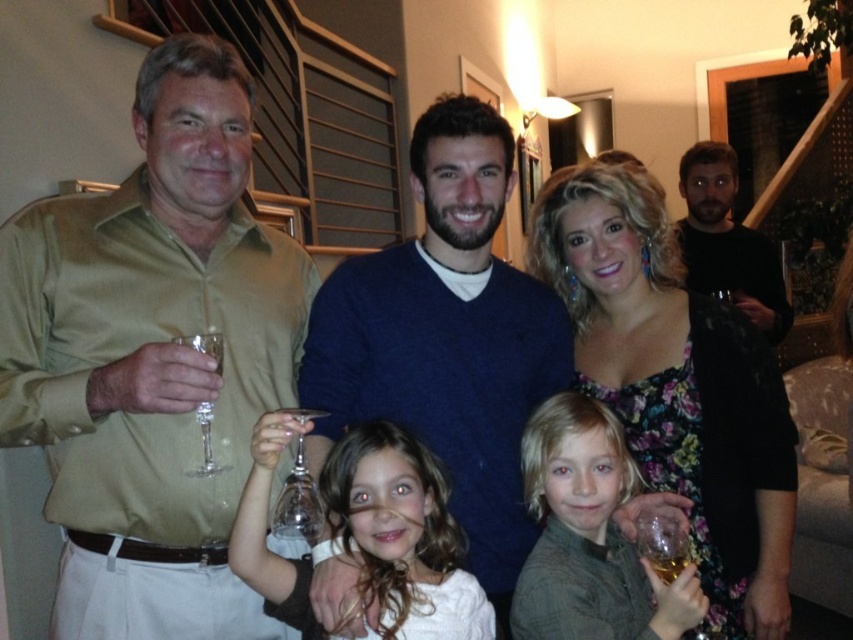
Is floral dress at center behind transparent glass wine glass at lower center?

Yes, floral dress at center is further from the viewer.

Is floral dress at center to the left of transparent glass wine glass at lower center from the viewer's perspective?

Incorrect, floral dress at center is not on the left side of transparent glass wine glass at lower center.

Is point (753, 394) positioned in front of point (299, 497)?

No.

This screenshot has width=853, height=640. Find the location of `floral dress at center`. floral dress at center is located at coordinates (676, 384).

Consider the image. Who is higher up, matte khaki shirt at left or floral dress at center?

matte khaki shirt at left is higher up.

Is matte khaki shirt at left below floral dress at center?

No, matte khaki shirt at left is not below floral dress at center.

Identify the location of matte khaki shirt at left. The image size is (853, 640). (152, 356).

Does matte khaki shirt at left appear over dark blue sweater at center?

Indeed, matte khaki shirt at left is positioned over dark blue sweater at center.

Does matte khaki shirt at left appear under dark blue sweater at center?

Actually, matte khaki shirt at left is above dark blue sweater at center.

The image size is (853, 640). In order to click on matte khaki shirt at left in this screenshot , I will do `click(152, 356)`.

Locate an element on the screen. matte khaki shirt at left is located at coordinates (152, 356).